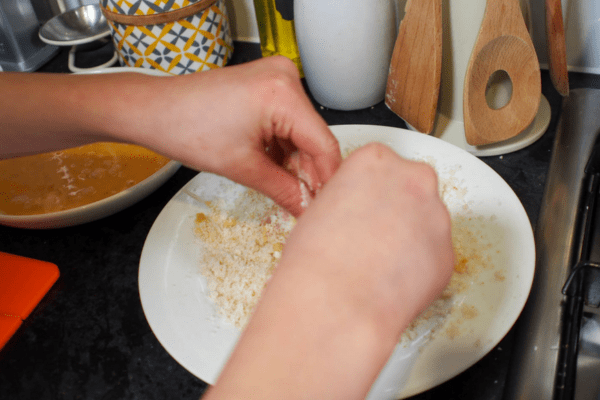
Identify the location of bowls. (x=160, y=283), (x=106, y=184).